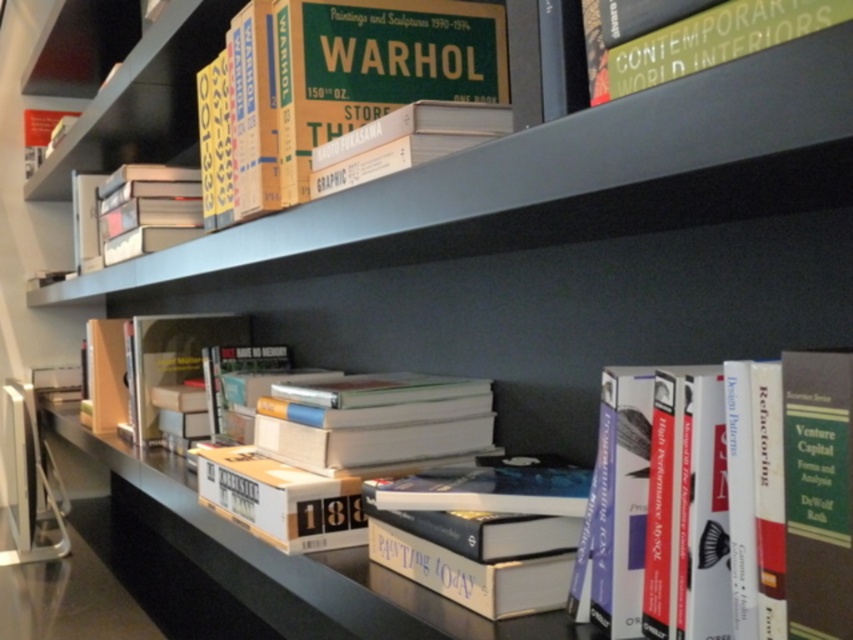
Question: Which point is closer to the camera?

Choices:
 (A) (421, 61)
 (B) (660, 72)
 (C) (815, 536)
 (D) (436, 236)

Answer: (C)

Question: Which point is farther to the camera?

Choices:
 (A) (723, 45)
 (B) (527, 138)
 (C) (834, 554)
 (D) (328, 104)

Answer: (D)

Question: Can you confirm if hardcover book at upper center is positioned above hardcover book at upper right?

Choices:
 (A) no
 (B) yes

Answer: (B)

Question: Where is hardcover book at center located in relation to hardcover book at upper right in the image?

Choices:
 (A) below
 (B) above

Answer: (A)

Question: Which point is farther to the camera?

Choices:
 (A) (657, 166)
 (B) (724, 628)

Answer: (B)

Question: Does metallic gray shelf at upper center have a lesser width compared to hardcover book at upper center?

Choices:
 (A) yes
 (B) no

Answer: (B)